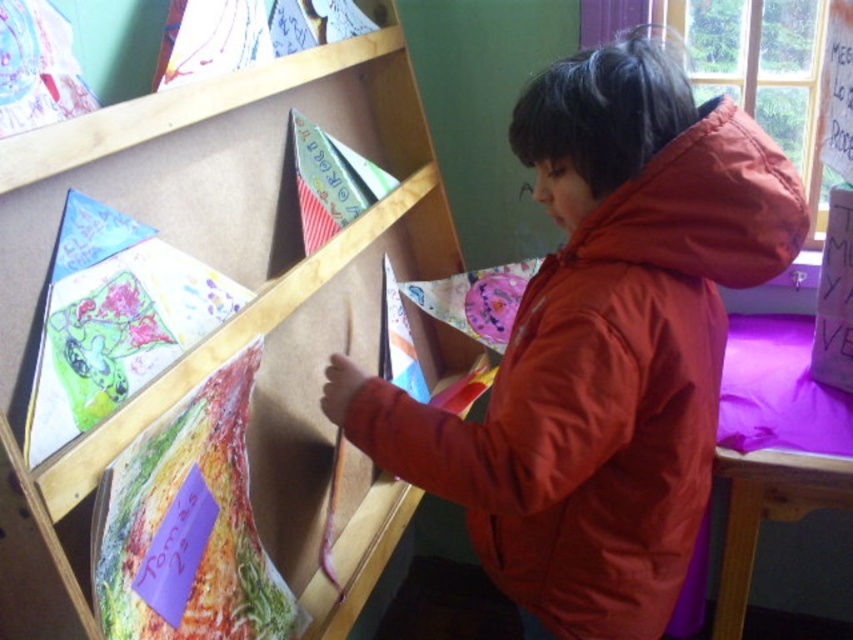
Question: Which of the following is the farthest from the observer?

Choices:
 (A) matte orange jacket at center
 (B) wooden bookshelf at upper left

Answer: (A)

Question: Which point is farther from the camera taking this photo?

Choices:
 (A) (659, 291)
 (B) (268, 394)

Answer: (B)

Question: Does matte orange jacket at center come in front of wooden bookshelf at upper left?

Choices:
 (A) no
 (B) yes

Answer: (A)

Question: In this image, where is matte orange jacket at center located relative to wooden bookshelf at upper left?

Choices:
 (A) left
 (B) right

Answer: (B)

Question: Which point is farther from the camera taking this photo?

Choices:
 (A) (683, 253)
 (B) (7, 596)

Answer: (A)

Question: Does matte orange jacket at center appear under wooden bookshelf at upper left?

Choices:
 (A) no
 (B) yes

Answer: (B)